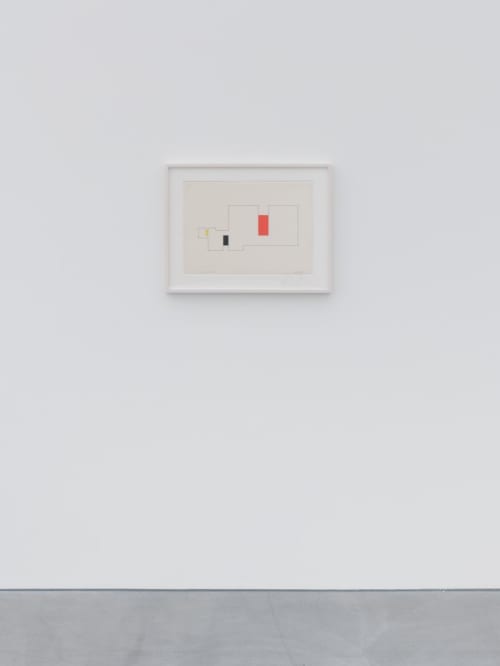
This screenshot has width=500, height=666. In order to click on photo mat in this screenshot , I will do `click(238, 172)`.